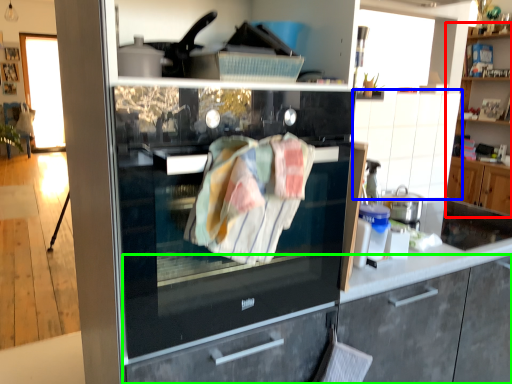
Question: Which object is the farthest from cabinetry (highlighted by a red box)? Choose among these: cabinetry (highlighted by a blue box) or cabinetry (highlighted by a green box).

Choices:
 (A) cabinetry
 (B) cabinetry

Answer: (B)